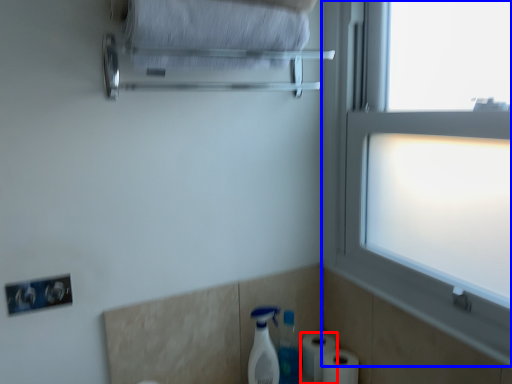
Question: Among these objects, which one is farthest to the camera, toilet paper (highlighted by a red box) or window (highlighted by a blue box)?

Choices:
 (A) toilet paper
 (B) window

Answer: (A)